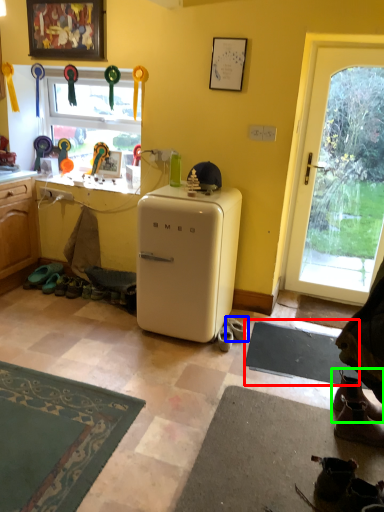
Question: Which object is the farthest from yoga mat (highlighted by a red box)? Choose among these: footwear (highlighted by a blue box) or footwear (highlighted by a green box).

Choices:
 (A) footwear
 (B) footwear

Answer: (B)